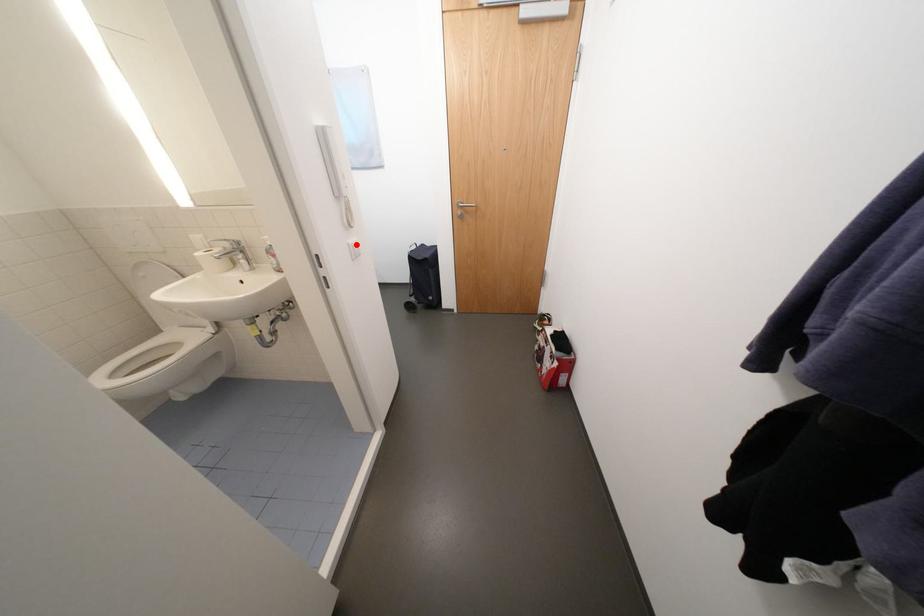
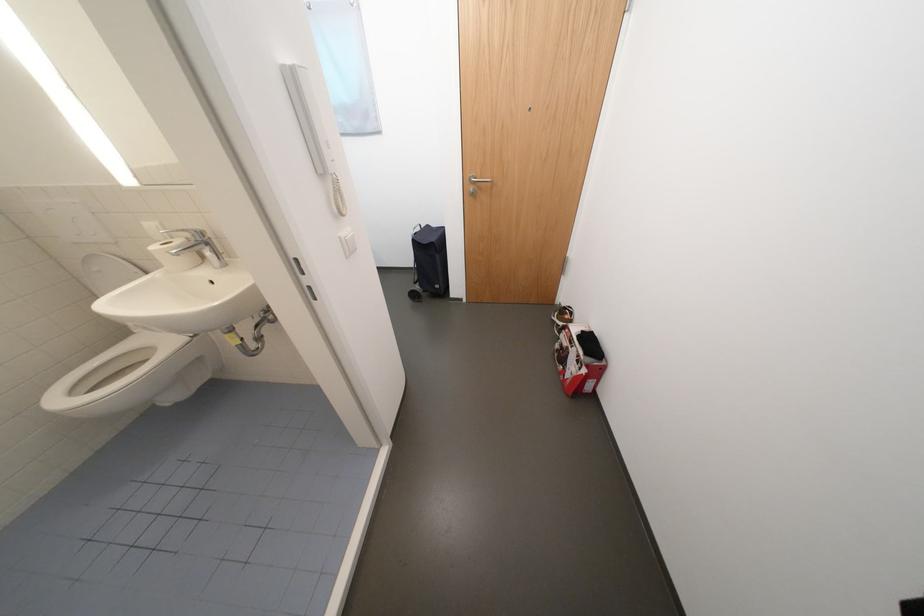
Find the pixel in the second image that matches the highlighted location in the first image.

(347, 238)